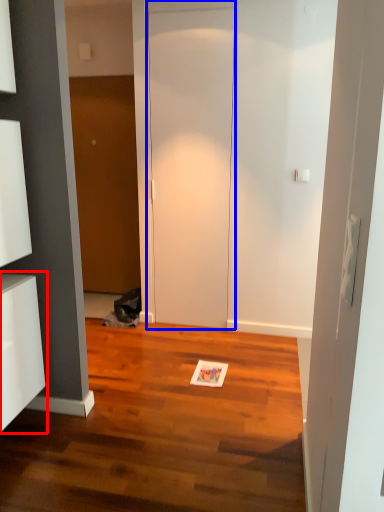
Question: Which of the following is the farthest to the observer, cabinetry (highlighted by a red box) or door (highlighted by a blue box)?

Choices:
 (A) cabinetry
 (B) door

Answer: (B)